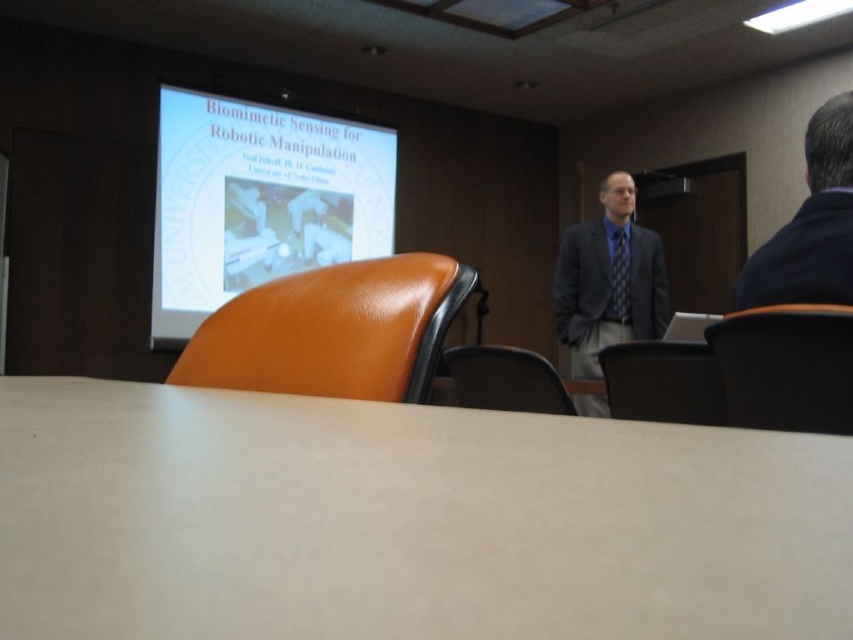
Is white glossy projection screen at upper center behind blue textured tie at center?

Yes.

Between white glossy projection screen at upper center and blue textured tie at center, which one is positioned higher?

white glossy projection screen at upper center is above.

Who is more forward, (x=386, y=160) or (x=614, y=234)?

Point (x=614, y=234) is more forward.

The height and width of the screenshot is (640, 853). What are the coordinates of `white glossy projection screen at upper center` in the screenshot? It's located at (258, 200).

Is leather-like orange chair at center shorter than black leather chair at lower center?

No.

Looking at this image, can you confirm if leather-like orange chair at center is wider than black leather chair at lower center?

Incorrect, leather-like orange chair at center's width does not surpass black leather chair at lower center's.

I want to click on leather-like orange chair at center, so click(x=785, y=368).

Is dark gray suit at center in front of dark blue shirt at upper right?

No, dark gray suit at center is behind dark blue shirt at upper right.

Is dark gray suit at center thinner than dark blue shirt at upper right?

No, dark gray suit at center is not thinner than dark blue shirt at upper right.

Where is `dark gray suit at center`? dark gray suit at center is located at coordinates (608, 280).